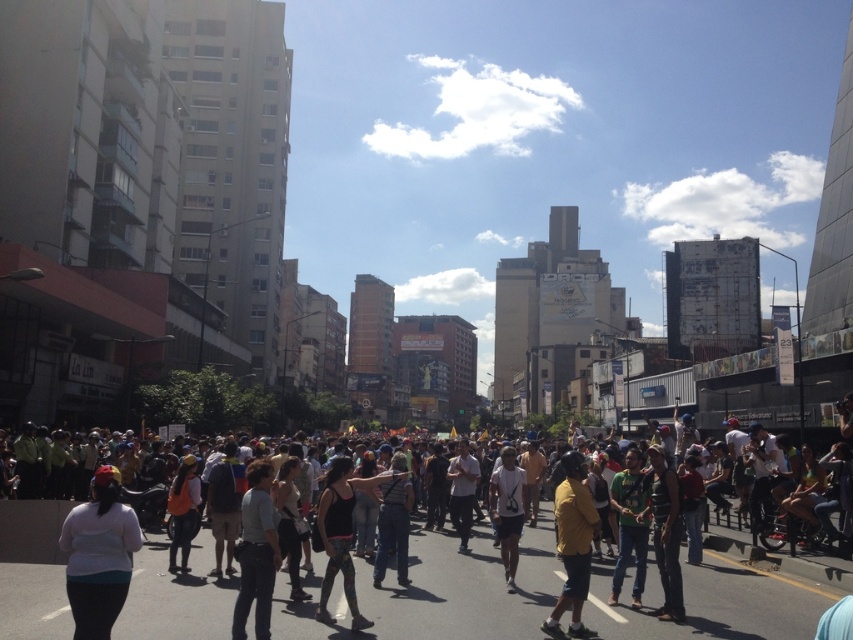
You are a photographer trying to capture the crowd in the city. You notice two people in the scene, one wearing multicolored casual attire at center and another in a white matte shirt at lower left. Which person is positioned lower in the image?

The multicolored casual attire at center is located below the white matte shirt at lower left, so the person in multicolored casual attire at center is positioned lower in the image.

You are a photographer trying to capture a wide shot of the crowd in the urban scene. You notice the multicolored casual attire at center and the white matte shirt at lower left. Which of these two items would appear wider in your photo?

The multicolored casual attire at center would appear wider in the photo because its width surpasses that of the white matte shirt at lower left.

You are a photographer trying to capture the vibrant colors of the multicolored casual attire at center in the image. Given that your camera has a focal length of 50mm and you are positioned at the point marked by the coordinates point (463, 592), what adjustment should you make to ensure the attire is in focus?

The point (463, 592) marks the multicolored casual attire at center, so you should adjust the focus to that point to ensure the attire is in focus.